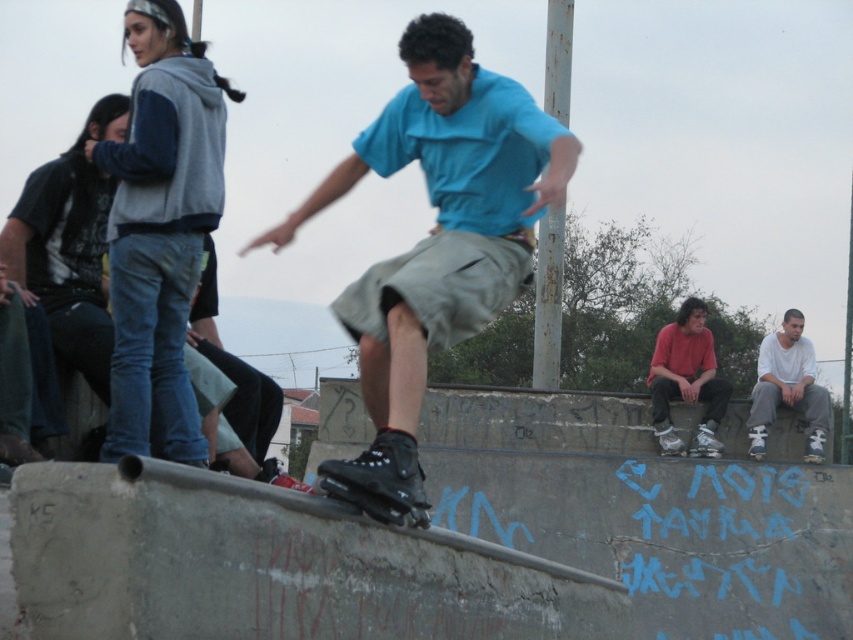
You are at a skatepark and see the red matte shirt at center and the black matte skateboard at center. Which object is positioned more to the right side of the scene?

The red matte shirt at center is positioned to the right of the black matte skateboard at center, so the red matte shirt at center is more to the right side of the scene.

Looking at this image, you are a photographer at the skatepark and want to capture a photo where the red matte shirt at center is clearly visible above the black matte skateboard at center. Based on the scene description, is this possible?

Yes, because the red matte shirt at center is located above the black matte skateboard at center according to the description.

Based on the scene description, where is the red matte shirt at center located in terms of coordinates?

The red matte shirt at center is located at coordinates point (686, 380).